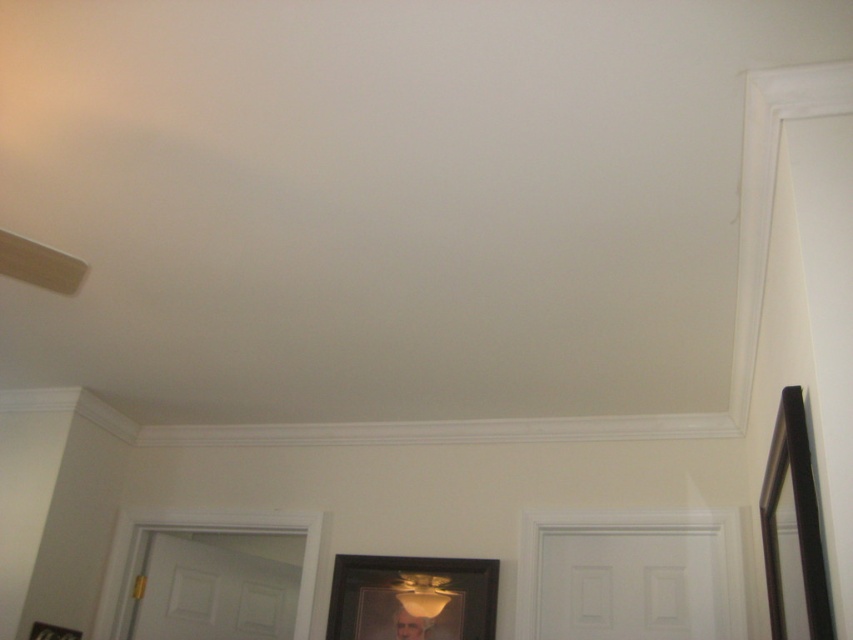
Is black matte picture frame at center shorter than matte yellow lampshade at center?

Incorrect, black matte picture frame at center's height does not fall short of matte yellow lampshade at center's.

Looking at this image, who is taller, black matte picture frame at center or matte yellow lampshade at center?

With more height is black matte picture frame at center.

I want to click on black matte picture frame at center, so click(412, 596).

Is point (440, 580) closer to camera compared to point (418, 611)?

That is False.

Measure the distance between matte yellow lampshade at center and camera.

The distance of matte yellow lampshade at center from camera is 10.71 feet.

The width and height of the screenshot is (853, 640). In order to click on matte yellow lampshade at center in this screenshot , I will do `click(422, 595)`.

Does black matte picture frame at right have a greater width compared to smooth gold portrait at center?

Yes.

Between point (805, 488) and point (392, 627), which one is positioned behind?

The point (392, 627) is behind.

Identify the location of black matte picture frame at right. The image size is (853, 640). (796, 516).